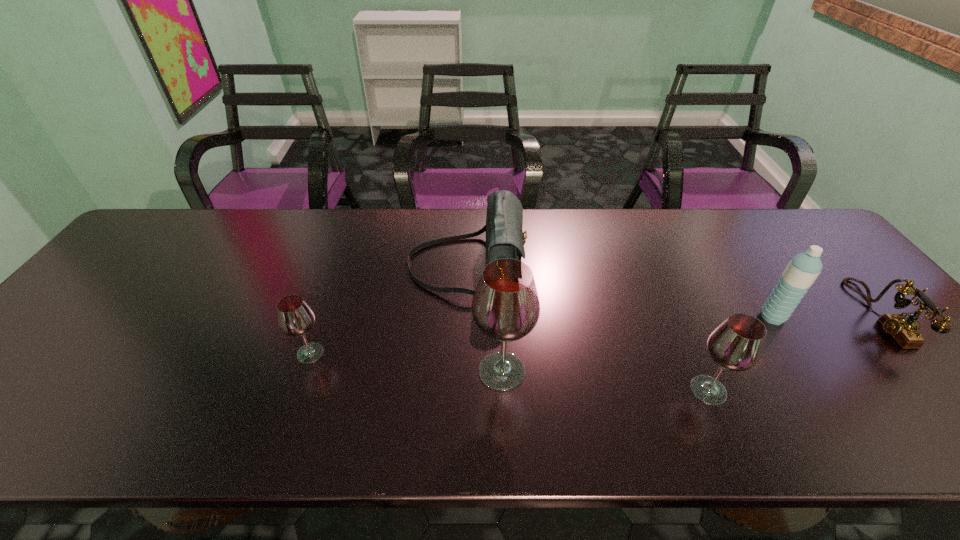
In the image, there is a desktop. At what (x,y) coordinates should I click in order to perform the action: click on vacant region at the far edge. Please return your answer as a coordinate pair (x, y). This screenshot has width=960, height=540. Looking at the image, I should click on (481, 212).

Find the location of a particular element. Image resolution: width=960 pixels, height=540 pixels. free space at the near edge of the desktop is located at coordinates (440, 386).

The width and height of the screenshot is (960, 540). What are the coordinates of `free space at the left edge of the desktop` in the screenshot? It's located at (85, 350).

Locate an element on the screen. free space at the far left corner of the desktop is located at coordinates (211, 212).

Where is `free space at the far right corner of the desktop`? free space at the far right corner of the desktop is located at coordinates (823, 255).

Image resolution: width=960 pixels, height=540 pixels. I want to click on vacant area that lies between the shoulder bag and the telephone, so click(x=672, y=290).

Identify the location of vacant area that lies between the leftmost wineglass and the tallest wineglass. (406, 362).

The image size is (960, 540). I want to click on free space between the second tallest wineglass and the shoulder bag, so click(588, 327).

Find the location of a particular element. The height and width of the screenshot is (540, 960). free space between the shortest wineglass and the water bottle is located at coordinates (541, 335).

Find the location of a particular element. Image resolution: width=960 pixels, height=540 pixels. free space between the second tallest wineglass and the second wineglass from left to right is located at coordinates (606, 381).